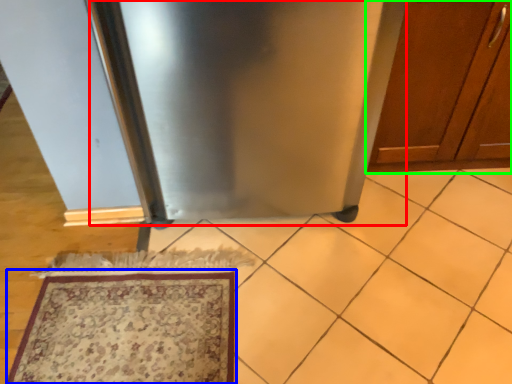
Question: Estimate the real-world distances between objects in this image. Which object is closer to appliance (highlighted by a red box), mat (highlighted by a blue box) or cabinetry (highlighted by a green box)?

Choices:
 (A) mat
 (B) cabinetry

Answer: (B)